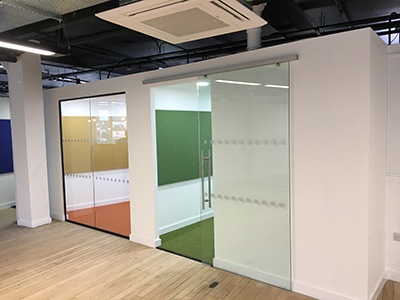
Where is `door`? door is located at coordinates (93, 151).